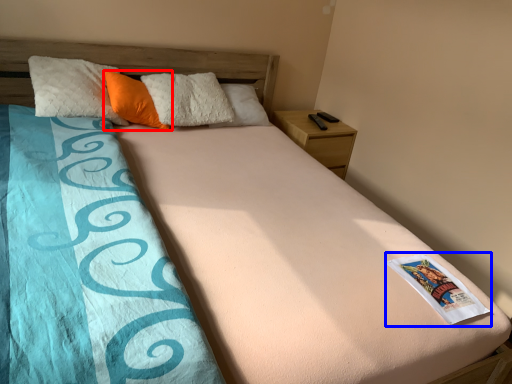
Question: Which object appears closest to the camera in this image, pillow (highlighted by a red box) or paperback book (highlighted by a blue box)?

Choices:
 (A) pillow
 (B) paperback book

Answer: (B)